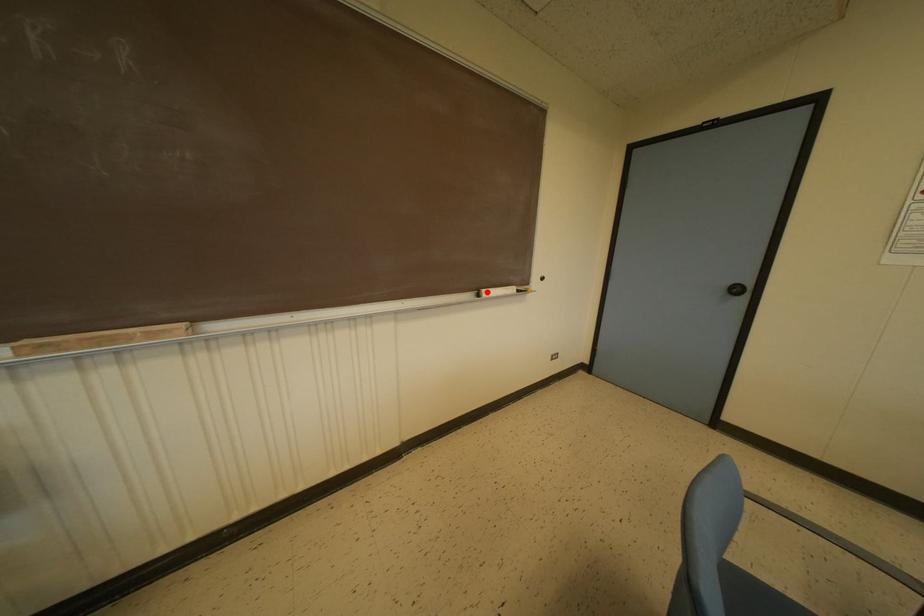
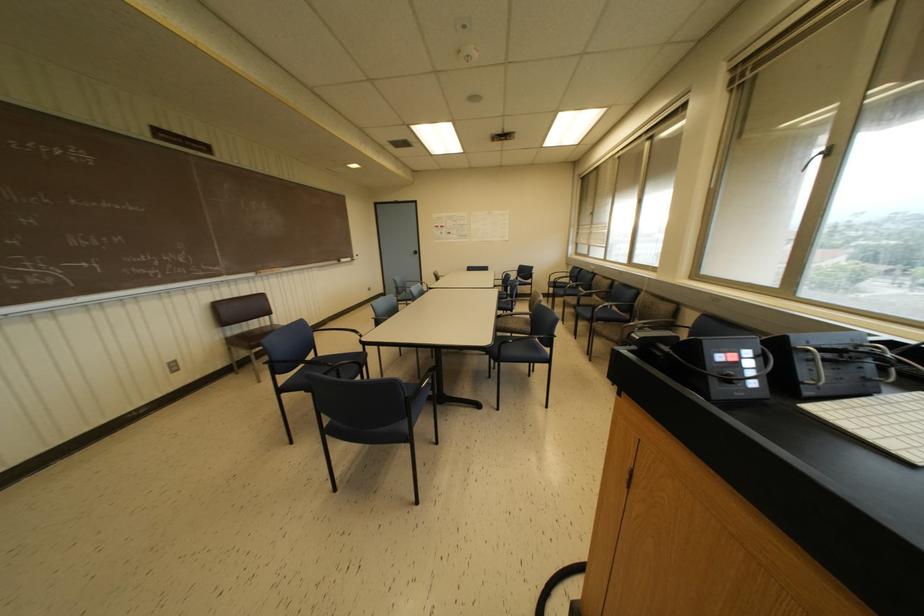
The point at the highlighted location is marked in the first image. Where is the corresponding point in the second image?

(342, 259)